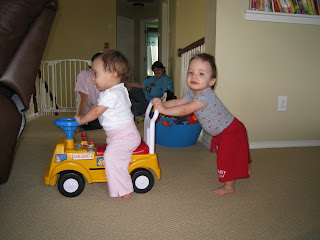
Where is `blue toy bin`? The height and width of the screenshot is (240, 320). blue toy bin is located at coordinates (184, 138).